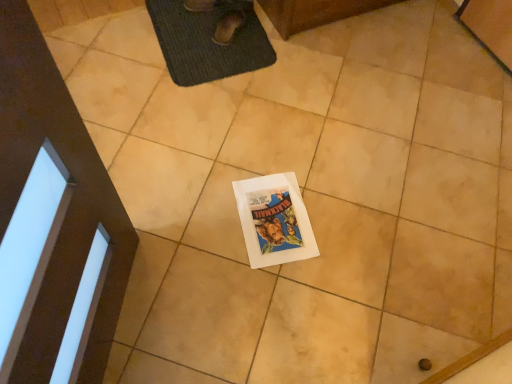
Where is `free space in front of dark gray textured bath mat at upper center`? The image size is (512, 384). free space in front of dark gray textured bath mat at upper center is located at coordinates (208, 117).